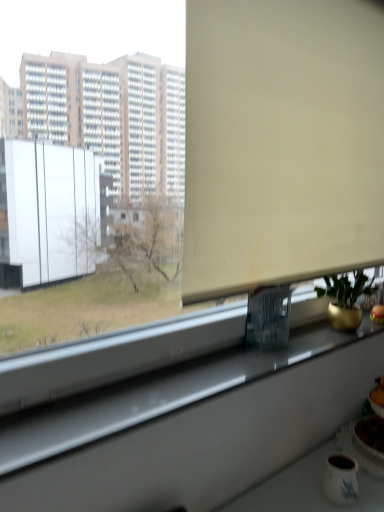
Locate an element on the screen. Image resolution: width=384 pixels, height=512 pixels. empty space that is ontop of white glossy window sill at lower center (from a real-world perspective) is located at coordinates (231, 366).